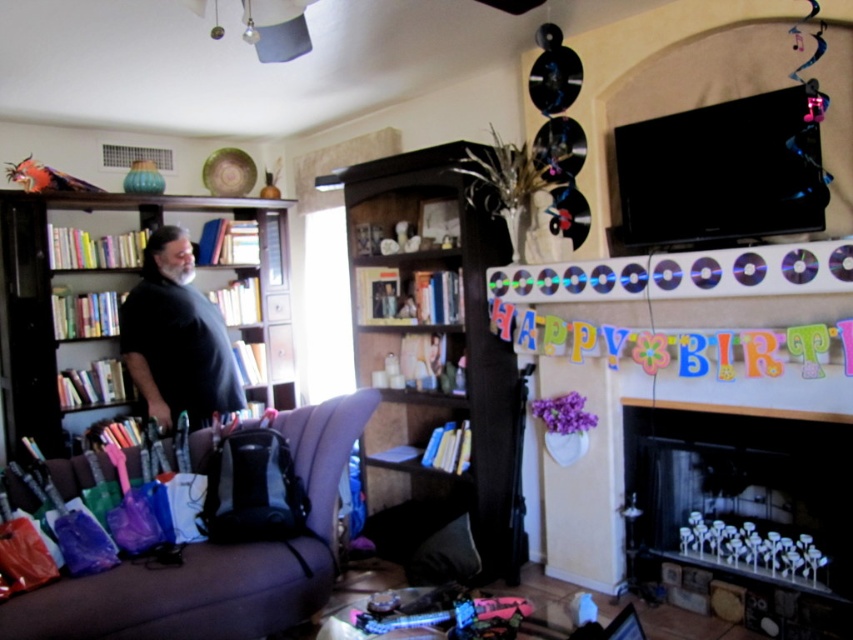
Is point (645, 513) in front of point (204, 410)?

Yes.

Does black glass fireplace at lower right have a lesser width compared to black matte shirt at left?

In fact, black glass fireplace at lower right might be wider than black matte shirt at left.

Between point (756, 612) and point (212, 356), which one is positioned in front?

Point (756, 612)

Where is `black glass fireplace at lower right`? The width and height of the screenshot is (853, 640). black glass fireplace at lower right is located at coordinates (747, 512).

Does dark wood bookshelf at center have a smaller size compared to black glass fireplace at lower right?

No, dark wood bookshelf at center is not smaller than black glass fireplace at lower right.

What do you see at coordinates (434, 355) in the screenshot? Image resolution: width=853 pixels, height=640 pixels. I see `dark wood bookshelf at center` at bounding box center [434, 355].

Find the location of a particular element. The height and width of the screenshot is (640, 853). dark wood bookshelf at center is located at coordinates (434, 355).

Looking at this image, can you confirm if black wood bookcase at left is positioned to the left of black glass fireplace at lower right?

Yes, black wood bookcase at left is to the left of black glass fireplace at lower right.

Does black wood bookcase at left appear on the right side of black glass fireplace at lower right?

In fact, black wood bookcase at left is to the left of black glass fireplace at lower right.

Between point (259, 273) and point (851, 545), which one is positioned behind?

Positioned behind is point (259, 273).

What are the coordinates of `black wood bookcase at left` in the screenshot? It's located at (141, 314).